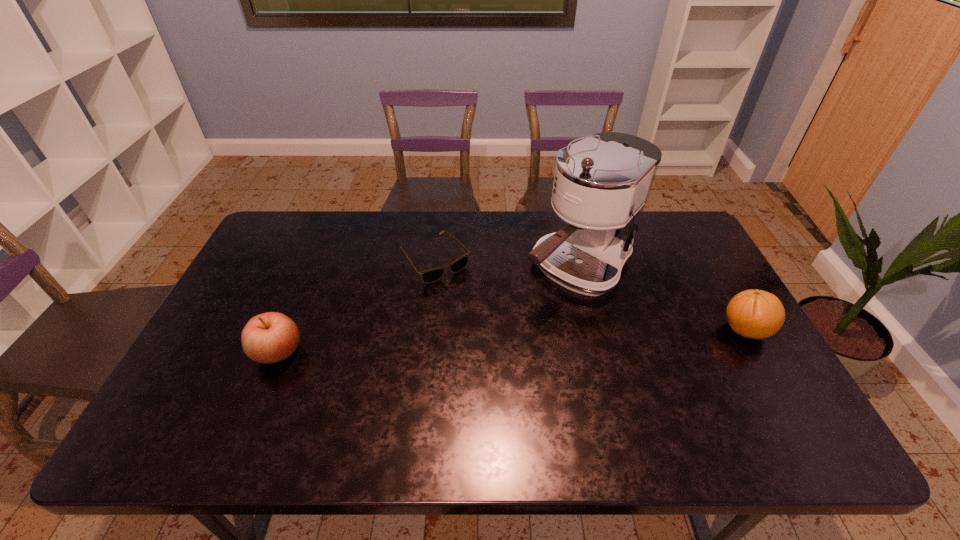
The image size is (960, 540). Identify the location of apple. (270, 337).

Where is `orange`? This screenshot has height=540, width=960. orange is located at coordinates (756, 314).

Identify the location of coffee maker. This screenshot has height=540, width=960. (601, 184).

Identify the location of the second object from right to left. The height and width of the screenshot is (540, 960). (601, 184).

The height and width of the screenshot is (540, 960). In order to click on the shortest object in this screenshot , I will do `click(429, 276)`.

The width and height of the screenshot is (960, 540). What are the coordinates of `the third object from right to left` in the screenshot? It's located at (429, 276).

I want to click on vacant space located on the left of the apple, so click(x=210, y=353).

Locate an element on the screen. vacant space located on the back of the rightmost object is located at coordinates (716, 279).

Where is `vacant region located 0.050m on the front-facing side of the coffee maker`? The height and width of the screenshot is (540, 960). vacant region located 0.050m on the front-facing side of the coffee maker is located at coordinates (532, 310).

This screenshot has height=540, width=960. I want to click on vacant region located on the front-facing side of the coffee maker, so click(450, 380).